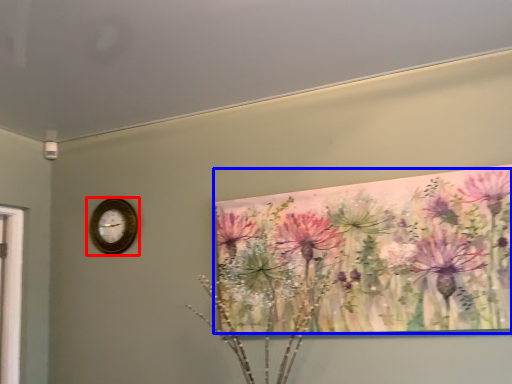
Question: Which object is closer to the camera taking this photo, wall clock (highlighted by a red box) or flower (highlighted by a blue box)?

Choices:
 (A) wall clock
 (B) flower

Answer: (B)